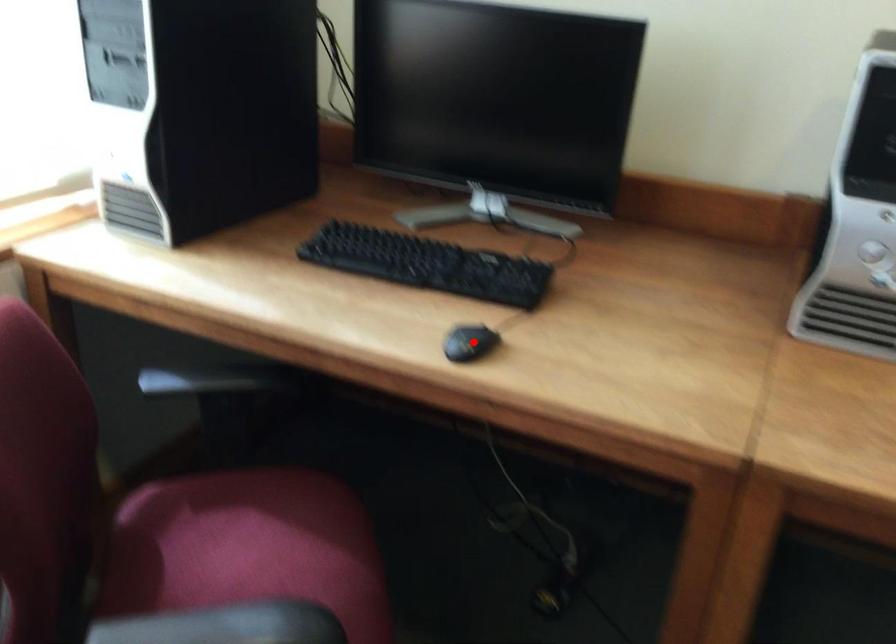
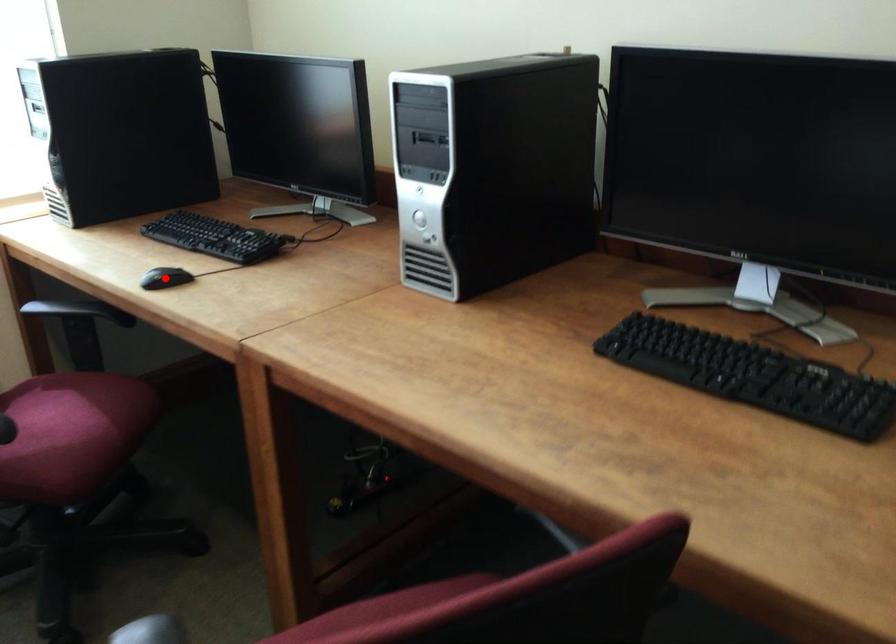
I am providing you with two images of the same scene from different viewpoints. A red point is marked on the first image and another point is marked on the second image. Do the highlighted points in image1 and image2 indicate the same real-world spot?

Yes